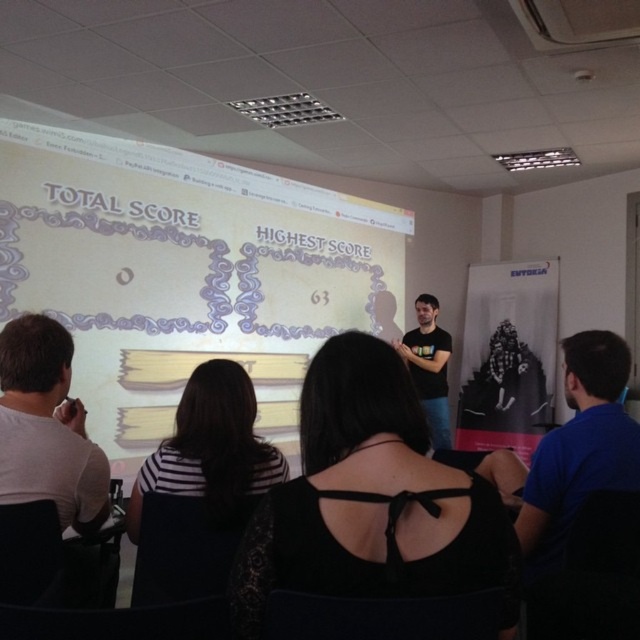
Who is more distant from viewer, (177, 477) or (10, 468)?

The point (177, 477) is behind.

Is black striped shirt at center to the right of matte white shirt at left from the viewer's perspective?

Indeed, black striped shirt at center is positioned on the right side of matte white shirt at left.

The image size is (640, 640). Describe the element at coordinates (200, 488) in the screenshot. I see `black striped shirt at center` at that location.

You are a GUI agent. You are given a task and a screenshot of the screen. Output one action in this format:
    pyautogui.click(x=<x>, y=<y>)
    Task: Click on the black striped shirt at center
    The width and height of the screenshot is (640, 640).
    Given the screenshot: What is the action you would take?
    click(x=200, y=488)

Does point (493, 492) come in front of point (227, 452)?

Yes, it is.

Does black lace dress at center have a larger size compared to black striped shirt at center?

No.

The image size is (640, 640). I want to click on black lace dress at center, so click(x=374, y=499).

Is white glossy projection screen at upper center shorter than matte white shirt at left?

In fact, white glossy projection screen at upper center may be taller than matte white shirt at left.

Which is below, white glossy projection screen at upper center or matte white shirt at left?

matte white shirt at left

Is point (278, 240) closer to camera compared to point (60, 394)?

That is False.

Locate an element on the screen. This screenshot has height=640, width=640. white glossy projection screen at upper center is located at coordinates (186, 273).